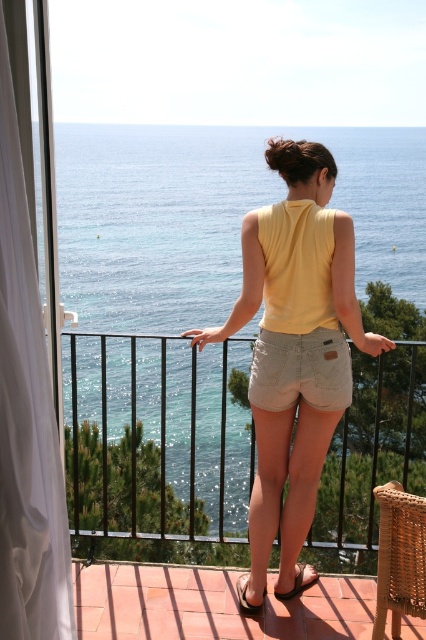
Is white sheer curtain at left bigger than brown leather sandal at lower center?

Yes, white sheer curtain at left is bigger than brown leather sandal at lower center.

Can you confirm if white sheer curtain at left is wider than brown leather sandal at lower center?

No.

Which is in front, point (0, 544) or point (241, 580)?

Point (0, 544)

Find the location of a particular element. The width and height of the screenshot is (426, 640). white sheer curtain at left is located at coordinates (26, 419).

Does point (305, 406) come farther from viewer compared to point (23, 636)?

Yes, point (305, 406) is farther from viewer.

Is yellow cotton tank top at center thinner than white sheer curtain at left?

In fact, yellow cotton tank top at center might be wider than white sheer curtain at left.

Between point (325, 256) and point (8, 490), which one is positioned behind?

The point (325, 256) is behind.

Find the location of `yellow cotton tank top at center`. yellow cotton tank top at center is located at coordinates pyautogui.click(x=294, y=346).

Is black metal railing at center in front of white sheer curtain at left?

No, it is not.

Who is lower down, black metal railing at center or white sheer curtain at left?

black metal railing at center is lower down.

Between point (408, 461) and point (13, 460), which one is positioned in front?

Point (13, 460)

At what (x,y) coordinates should I click in order to perform the action: click on black metal railing at center. Please return your answer as a coordinate pair (x, y). This screenshot has width=426, height=640. Looking at the image, I should click on (152, 445).